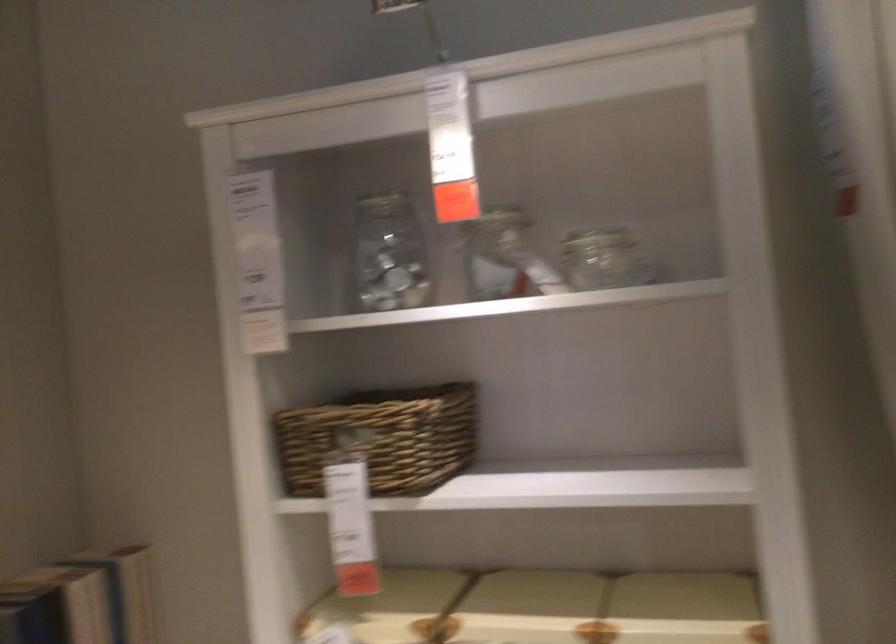
Identify the location of glass jar lid. The height and width of the screenshot is (644, 896). (597, 238).